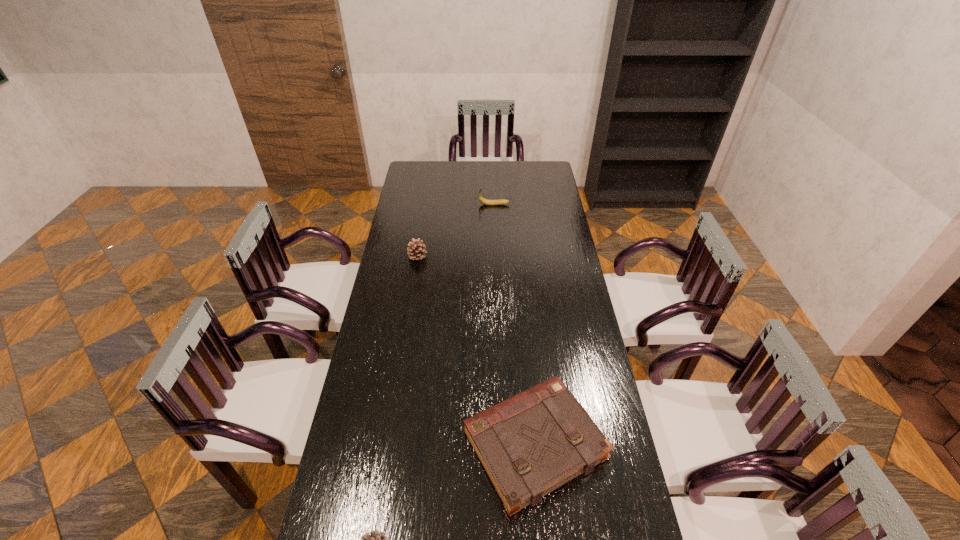
Find the location of `free space at the far edge`. free space at the far edge is located at coordinates (472, 176).

You are a GUI agent. You are given a task and a screenshot of the screen. Output one action in this format:
    pyautogui.click(x=<x>, y=<y>)
    Task: Click on the vacant space at the left edge of the desktop
    The image size is (960, 540).
    Given the screenshot: What is the action you would take?
    pyautogui.click(x=395, y=244)

Find the location of a particular element. blank space at the right edge of the desktop is located at coordinates (579, 340).

This screenshot has height=540, width=960. Identify the location of vacant space at the far left corner. (428, 180).

The width and height of the screenshot is (960, 540). Identify the location of free space at the far right corner of the desktop. (542, 181).

Identify the location of vacant point located between the banana and the second nearest object. (515, 325).

The image size is (960, 540). Identify the location of free space between the farther pinecone and the farthest object. (456, 230).

Locate an element on the screen. This screenshot has height=540, width=960. unoccupied position between the third farthest object and the farthest object is located at coordinates (515, 325).

At what (x,y) coordinates should I click in order to perform the action: click on vacant point located between the third nearest object and the banana. Please return your answer as a coordinate pair (x, y). Looking at the image, I should click on (456, 230).

Locate an element on the screen. Image resolution: width=960 pixels, height=540 pixels. free space between the farthest object and the farther pinecone is located at coordinates (456, 230).